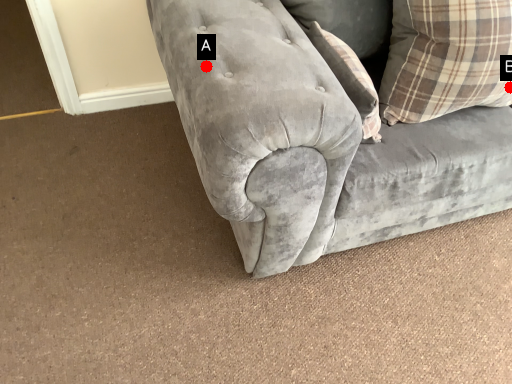
Question: Two points are circled on the image, labeled by A and B beside each circle. Which point is closer to the camera taking this photo?

Choices:
 (A) A is closer
 (B) B is closer

Answer: (A)